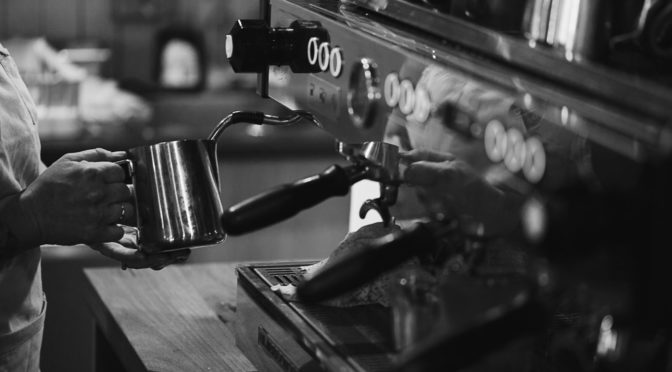
You are a GUI agent. You are given a task and a screenshot of the screen. Output one action in this format:
    pyautogui.click(x=<x>, y=<y>)
    Task: Click on the milk steamer
    This screenshot has height=372, width=672.
    Given the screenshot: What is the action you would take?
    pos(218,125)